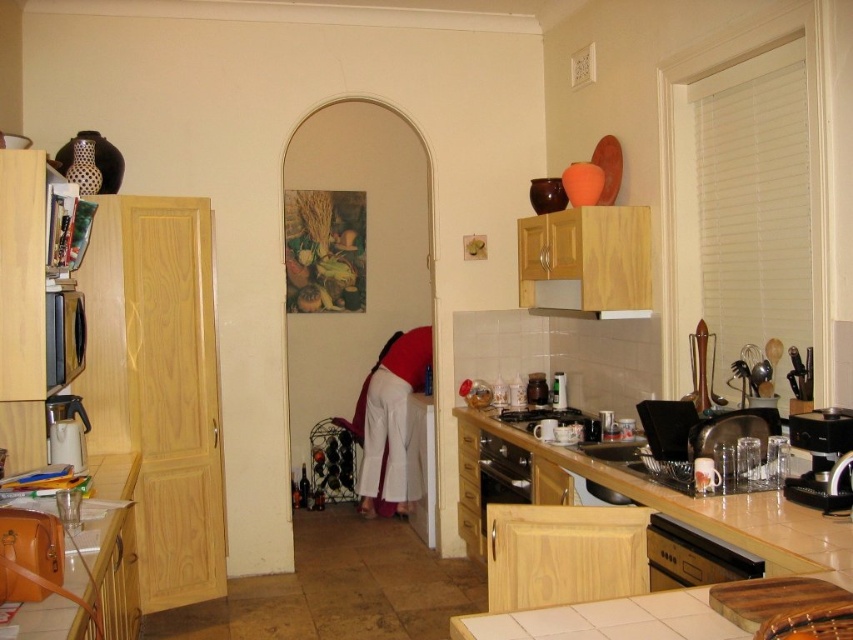
Who is shorter, black plastic coffee maker at right or matte black stove at center?

Standing shorter between the two is matte black stove at center.

Which is behind, point (833, 496) or point (532, 428)?

The point (532, 428) is more distant.

The width and height of the screenshot is (853, 640). I want to click on black plastic coffee maker at right, so click(821, 458).

Can you confirm if black plastic coffee maker at right is taller than wooden exhaust hood at upper center?

Yes.

Is black plastic coffee maker at right wider than wooden exhaust hood at upper center?

No.

Which is behind, point (822, 422) or point (538, 292)?

Positioned behind is point (538, 292).

Identify the location of black plastic coffee maker at right. (821, 458).

Does light brown wood at center have a lesser width compared to brown leather bag at lower left?

No.

Is light brown wood at center smaller than brown leather bag at lower left?

Yes.

Where is `light brown wood at center`? This screenshot has width=853, height=640. light brown wood at center is located at coordinates (704, 508).